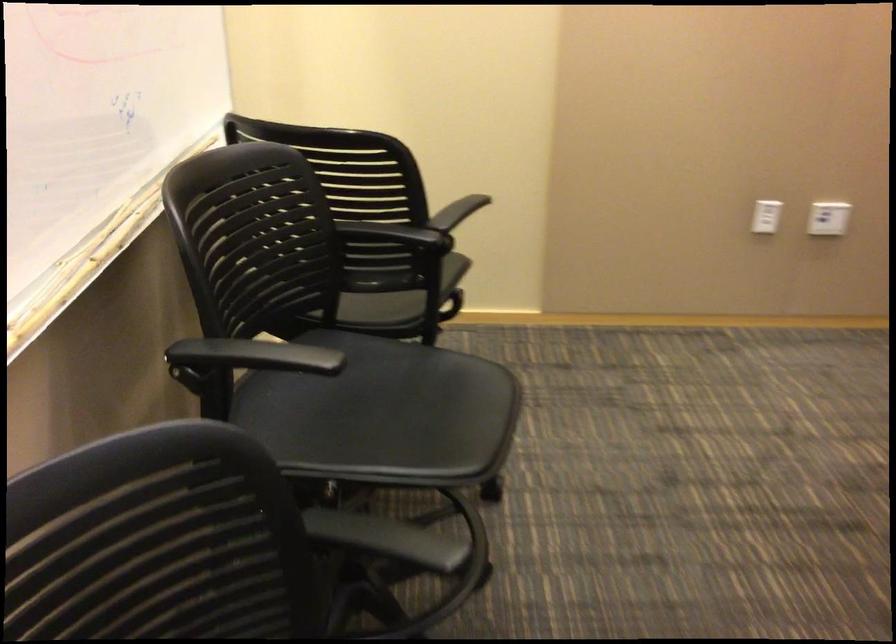
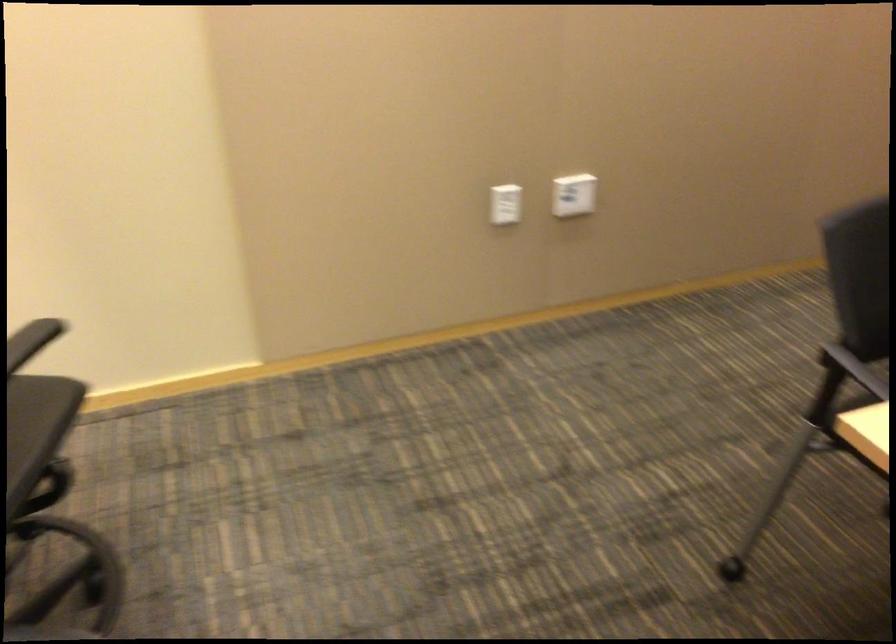
Question: Based on the continuous images, in which direction is the camera rotating? Reply with the corresponding letter.

Choices:
 (A) Left
 (B) Right
 (C) Up
 (D) Down

Answer: (B)